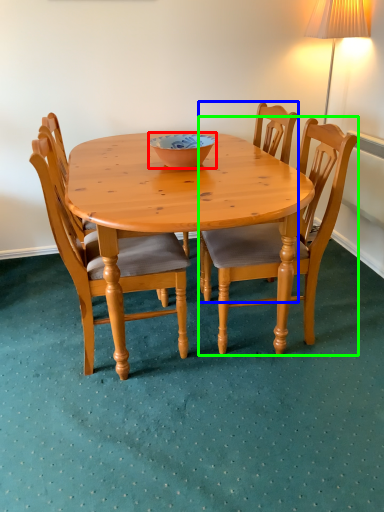
Question: Which object is positioned farthest from bowl (highlighted by a red box)? Select from chair (highlighted by a blue box) and chair (highlighted by a green box).

Choices:
 (A) chair
 (B) chair

Answer: (B)